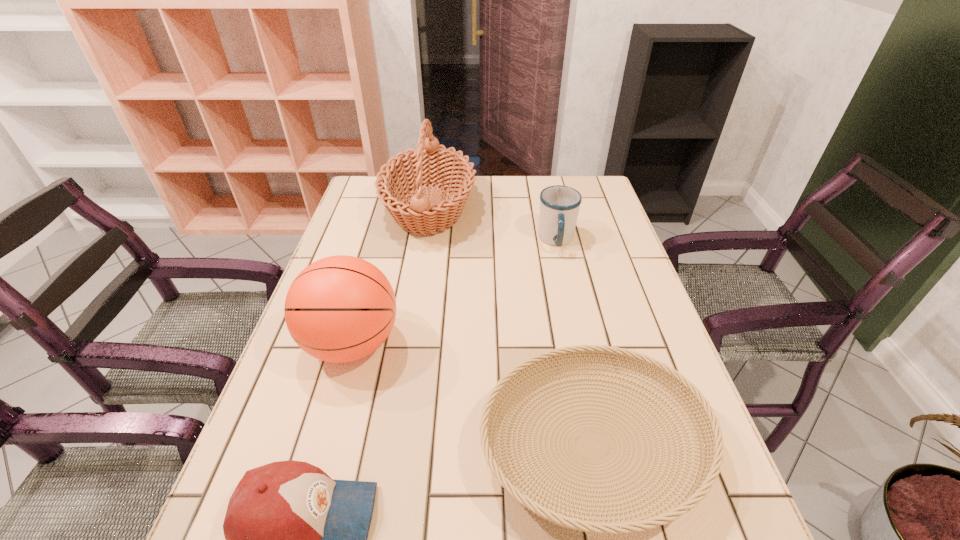
You are a GUI agent. You are given a task and a screenshot of the screen. Output one action in this format:
    pyautogui.click(x=<x>, y=<y>)
    Task: Click on the object at the right edge
    
    Given the screenshot: What is the action you would take?
    pyautogui.click(x=559, y=205)

This screenshot has width=960, height=540. Find the location of `object at the far left corner`. object at the far left corner is located at coordinates (410, 171).

The width and height of the screenshot is (960, 540). In order to click on free space at the far edge of the desktop in this screenshot , I will do `click(525, 194)`.

What are the coordinates of `vacant space at the left edge of the desktop` in the screenshot? It's located at (324, 422).

Locate an element on the screen. This screenshot has width=960, height=540. vacant position at the right edge of the desktop is located at coordinates (684, 402).

Find the location of a particular element. The width and height of the screenshot is (960, 540). vacant space at the far right corner of the desktop is located at coordinates (599, 201).

At what (x,y) coordinates should I click in order to perform the action: click on empty space between the left basket and the mug. Please return your answer as a coordinate pair (x, y). The height and width of the screenshot is (540, 960). Looking at the image, I should click on (492, 225).

The height and width of the screenshot is (540, 960). I want to click on vacant area that lies between the tallest object and the second tallest object, so click(391, 276).

This screenshot has height=540, width=960. What are the coordinates of `vacant area that lies between the taller basket and the third tallest object` in the screenshot? It's located at (492, 225).

At what (x,y) coordinates should I click in order to perform the action: click on object that is the closest one to the third tallest object. Please return your answer as a coordinate pair (x, y). Looking at the image, I should click on (410, 171).